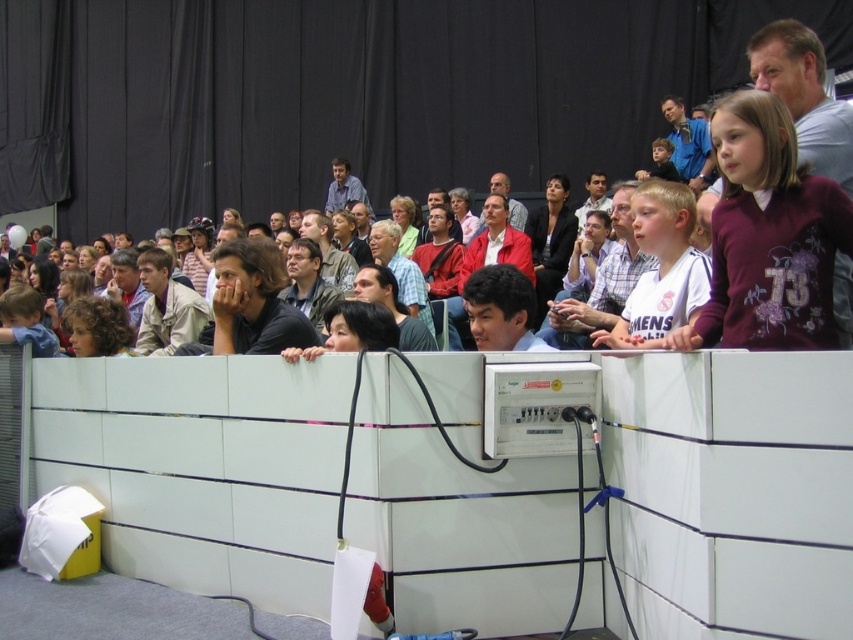
You are a photographer at the event and need to capture both the white jersey at center and the gray fabric jacket at center in the same frame. Which object should you position to the left in your camera viewfinder to ensure both are visible?

To capture both the white jersey at center and the gray fabric jacket at center in the same frame, position the gray fabric jacket at center to the left since the white jersey at center is on its right side.

You are a photographer at the event and want to capture a photo of both the light brown hair at center and the matte blue shirt at center in the same frame. Which object should you focus on first to ensure both are in the frame?

You should focus on the matte blue shirt at center first since the light brown hair at center is on the right side of it, so by centering the matte blue shirt at center, the light brown hair at center will naturally be included to the right.